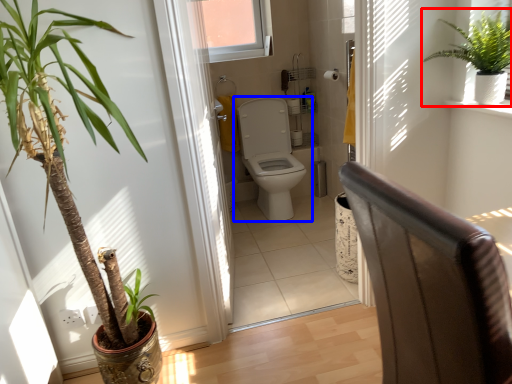
Question: Which object is closer to the camera taking this photo, houseplant (highlighted by a red box) or toilet (highlighted by a blue box)?

Choices:
 (A) houseplant
 (B) toilet

Answer: (A)